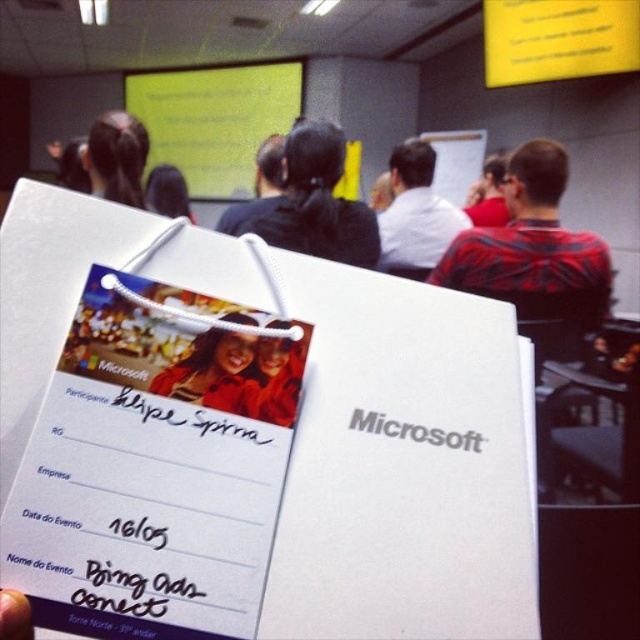
Between black hair at upper left and matte red sweater at center, which one has more height?

black hair at upper left

Does black hair at upper left have a lesser width compared to matte red sweater at center?

No.

Measure the distance between black hair at upper left and camera.

black hair at upper left and camera are 2.01 meters apart.

Find the location of a particular element. Image resolution: width=640 pixels, height=640 pixels. black hair at upper left is located at coordinates (116, 157).

Who is taller, matte black shirt at upper center or matte black hair at upper center?

matte black shirt at upper center is taller.

Where is `matte black shirt at upper center`? matte black shirt at upper center is located at coordinates (488, 195).

Image resolution: width=640 pixels, height=640 pixels. Describe the element at coordinates (488, 195) in the screenshot. I see `matte black shirt at upper center` at that location.

Image resolution: width=640 pixels, height=640 pixels. I want to click on matte black shirt at upper center, so click(x=488, y=195).

Looking at this image, which is above, red and black striped shirt at upper right or matte black hair at upper center?

matte black hair at upper center

Is red and black striped shirt at upper right wider than matte black hair at upper center?

Yes.

Which is behind, point (557, 176) or point (188, 211)?

The point (188, 211) is more distant.

Find the location of a particular element. The image size is (640, 640). red and black striped shirt at upper right is located at coordinates (531, 240).